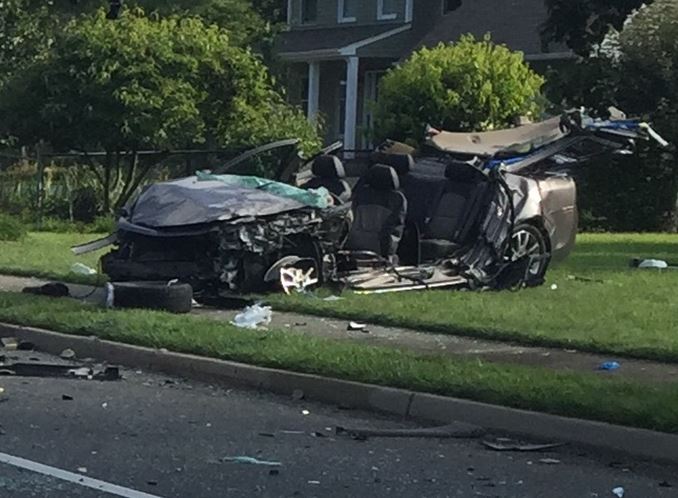
Where is `hood`? hood is located at coordinates (194, 206).